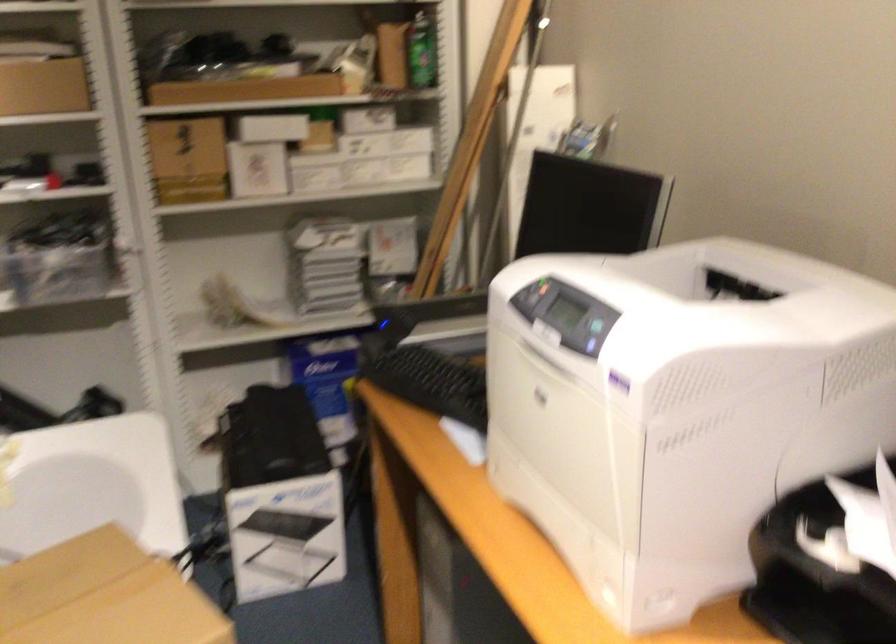
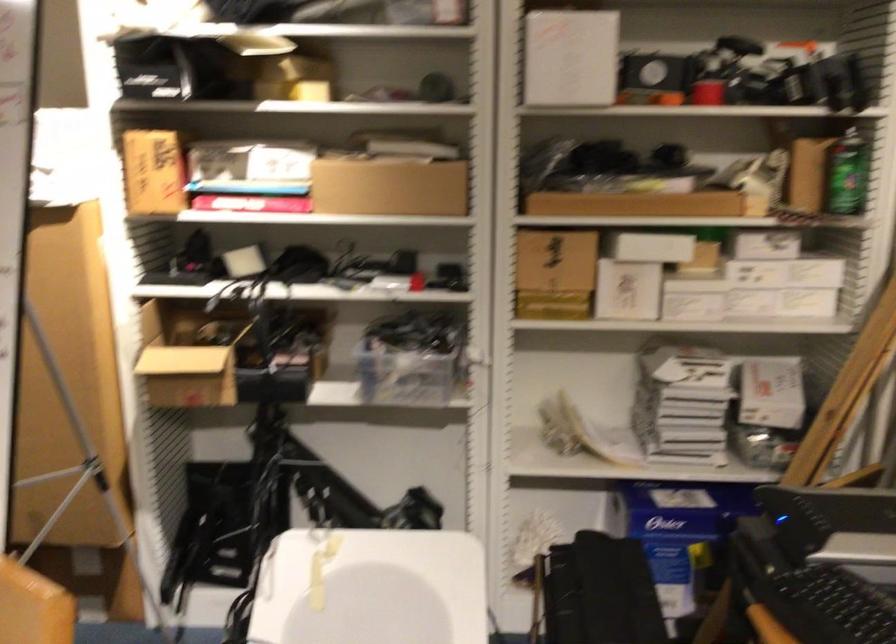
Locate, in the second image, the point that corresponds to (334,374) in the first image.

(683, 534)